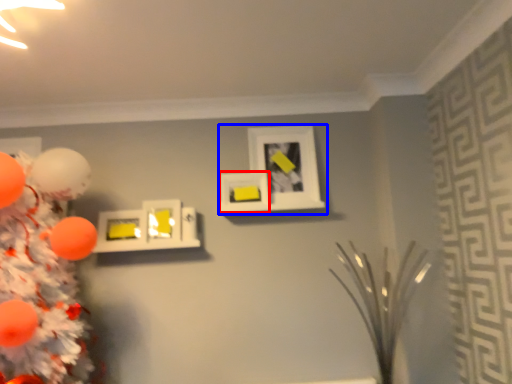
Question: Which object appears farthest to the camera in this image, picture frame (highlighted by a red box) or picture frame (highlighted by a blue box)?

Choices:
 (A) picture frame
 (B) picture frame

Answer: (B)